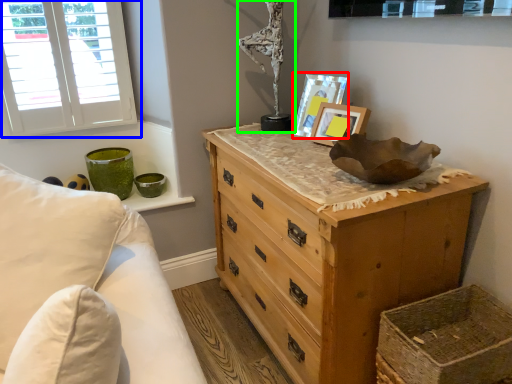
Question: Which is farther away from picture frame (highlighted by a red box)? window (highlighted by a blue box) or antique (highlighted by a green box)?

Choices:
 (A) window
 (B) antique

Answer: (A)